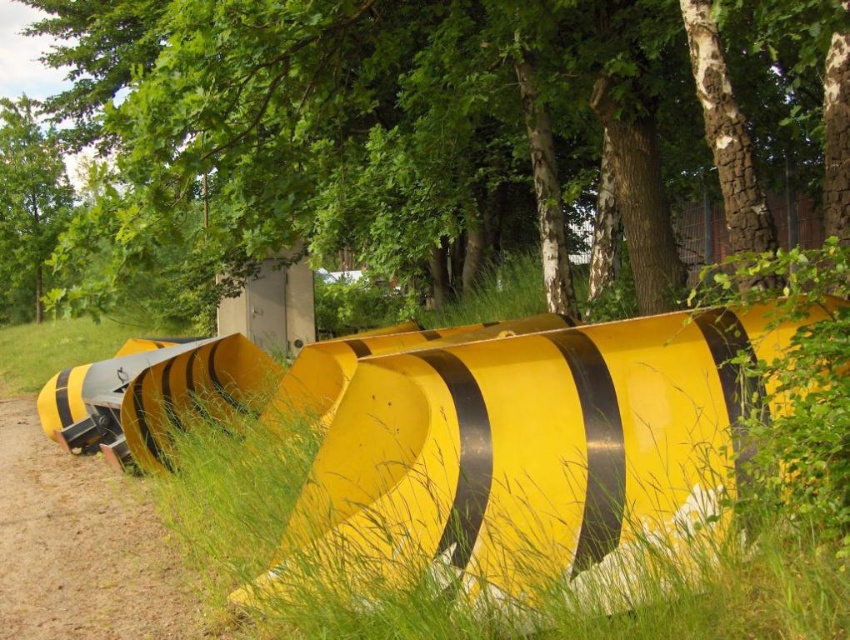
Question: Among these objects, which one is farthest from the camera?

Choices:
 (A) green leafy tree at upper left
 (B) yellow matte dirt track at lower left
 (C) brown textured tree at upper center

Answer: (A)

Question: Can you confirm if brown textured tree at upper center is positioned below yellow matte dirt track at lower left?

Choices:
 (A) no
 (B) yes

Answer: (A)

Question: Which point is closer to the camera taking this photo?

Choices:
 (A) (384, 60)
 (B) (18, 486)
 (C) (21, 100)

Answer: (B)

Question: Is brown textured tree at upper center above yellow matte dirt track at lower left?

Choices:
 (A) yes
 (B) no

Answer: (A)

Question: Among these objects, which one is nearest to the camera?

Choices:
 (A) brown textured tree at upper center
 (B) green leafy tree at upper left
 (C) yellow matte dirt track at lower left

Answer: (A)

Question: Is brown textured tree at upper center to the right of yellow matte dirt track at lower left from the viewer's perspective?

Choices:
 (A) no
 (B) yes

Answer: (A)